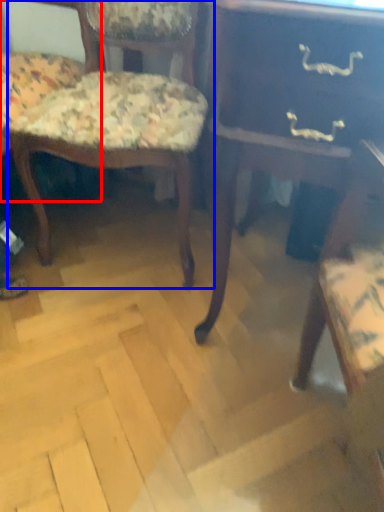
Question: Which of the following is the farthest to the observer, chair (highlighted by a red box) or chair (highlighted by a blue box)?

Choices:
 (A) chair
 (B) chair

Answer: (B)